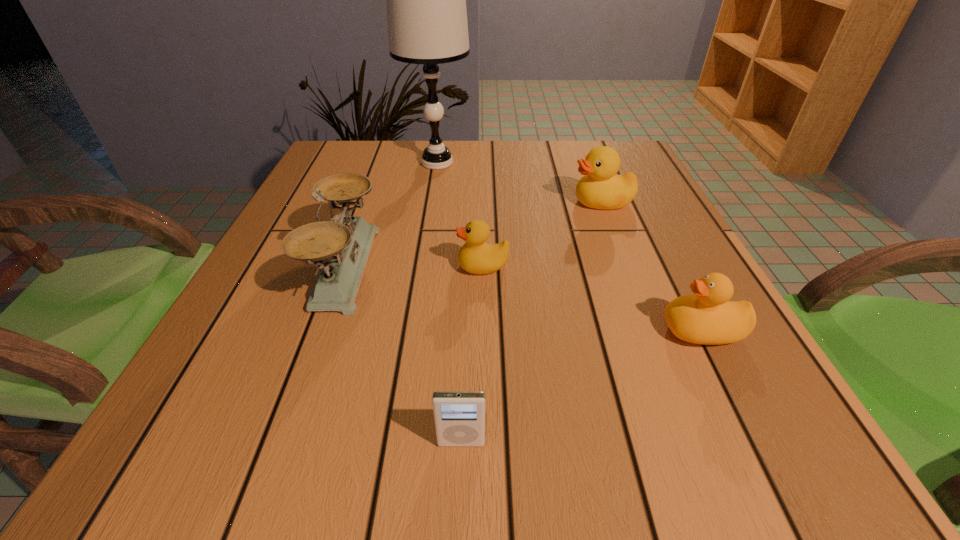
Where is `the farthest object`? Image resolution: width=960 pixels, height=540 pixels. the farthest object is located at coordinates (426, 0).

Where is `table lamp`? This screenshot has height=540, width=960. table lamp is located at coordinates (426, 0).

The height and width of the screenshot is (540, 960). I want to click on the second tallest object, so click(340, 247).

I want to click on the fifth nearest object, so click(x=600, y=188).

Locate an element on the screen. the nearest duck is located at coordinates (707, 317).

You are a GUI agent. You are given a task and a screenshot of the screen. Output one action in this format:
    pyautogui.click(x=<x>, y=<y>)
    Task: Click on the iPod
    
    Given the screenshot: What is the action you would take?
    pyautogui.click(x=459, y=416)

You are a GUI agent. You are given a task and a screenshot of the screen. Output one action in this format:
    pyautogui.click(x=<x>, y=<y>)
    Task: Click on the leftmost duck
    The image size is (960, 540).
    Given the screenshot: What is the action you would take?
    pyautogui.click(x=476, y=257)

Identify the location of free point located 0.050m on the back of the farthest object. (441, 140).

Identify the location of free space located 0.170m on the front-facing side of the second tallest object. The image size is (960, 540). (463, 267).

The width and height of the screenshot is (960, 540). Identify the location of vacant region located at the beak of the second farthest object. (488, 202).